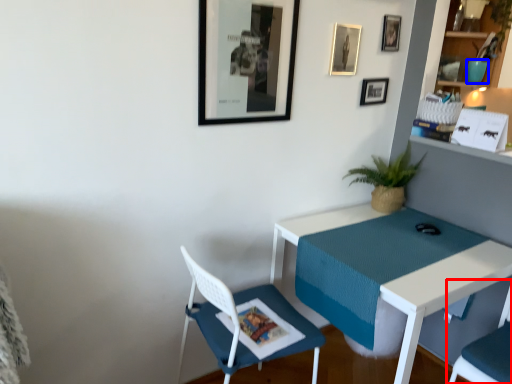
Question: Which point is further to the camera, chair (highlighted by a red box) or teal (highlighted by a blue box)?

Choices:
 (A) chair
 (B) teal

Answer: (B)